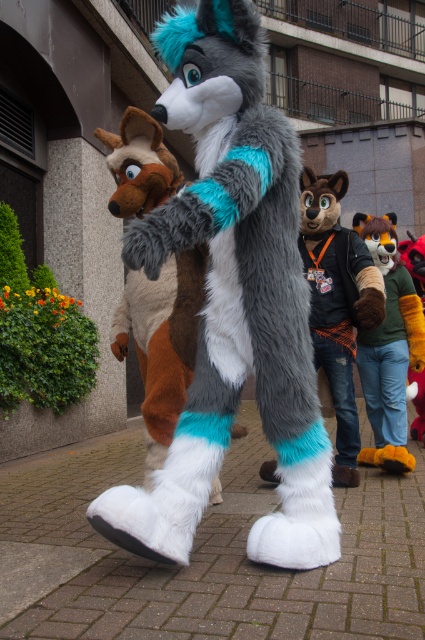
You are organizing a costume party and need to arrange the fluffy fur suit at center and the green fuzzy sweater at right on a rack. If the rack has limited space, which costume should be placed first to ensure both fit properly?

The fluffy fur suit at center should be placed first since it is smaller in size compared to the green fuzzy sweater at right, allowing both to fit on the rack.

Looking at the image of the lively fursuit scene, you notice two objects labeled the fluffy fur wolf at center and the fluffy fur coat at center. Which one is positioned higher in the image?

The fluffy fur wolf at center is located above the fluffy fur coat at center, so it is positioned higher in the image.

You are standing at the entrance of a convention hall and see the fluffy fur wolf at center and the fluffy fur coat at center in the distance. Which one is closer to you?

The fluffy fur wolf at center is closer to you since it is only 4.73 feet away from the fluffy fur coat at center, meaning the wolf is nearer than the coat.